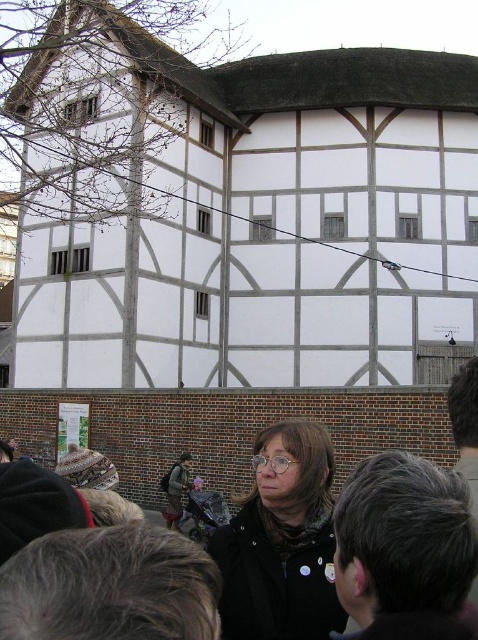
You are a photographer trying to capture the historic building in the background. However, there are two people blocking your view. The dark gray hair at upper right and the matte black coat at center are in the way. Which person should you ask to move so you can see the building better?

You should ask the dark gray hair at upper right to move because it is in front of the matte black coat at center, making it closer to your line of sight and blocking more of the building.

You are an artist trying to sketch the historic building. You notice two elements in the scene that might distract from the building. Which of the two elements, the dark gray hair at upper right or the matte black coat at center, would you choose to include in your drawing to maintain focus on the building?

The dark gray hair at upper right has a smaller size compared to the matte black coat at center, so including the smaller dark gray hair at upper right would be less distracting and help maintain focus on the historic building.